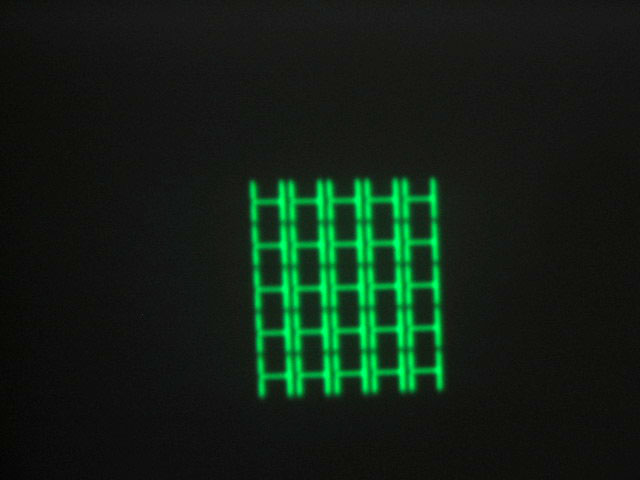
I want to click on right sided corner, so click(x=636, y=191).